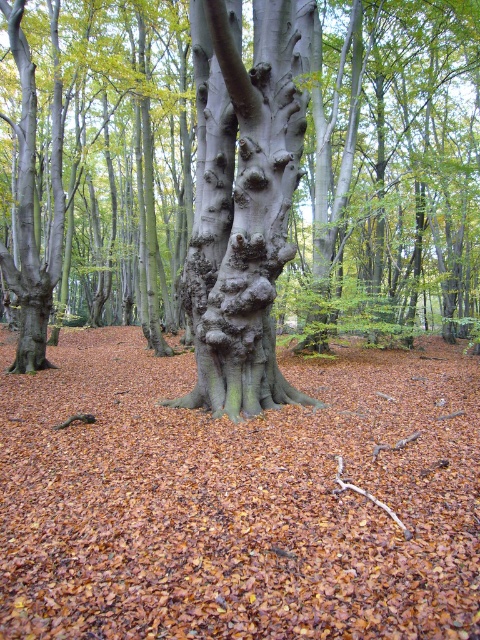
Does smooth gray tree trunk at center appear on the right side of smooth gray bark at center?

Incorrect, smooth gray tree trunk at center is not on the right side of smooth gray bark at center.

Is point (466, 125) positioned after point (196, 32)?

Yes, it is.

Locate an element on the screen. This screenshot has height=640, width=480. smooth gray tree trunk at center is located at coordinates (98, 163).

Is point (362, 392) closer to camera compared to point (241, 172)?

No, (362, 392) is further to viewer.

Is brown matte tree trunk at center closer to camera compared to smooth gray bark at center?

Yes, it is in front of smooth gray bark at center.

Does point (326, 472) lie behind point (261, 276)?

No, it is not.

Locate an element on the screen. This screenshot has width=480, height=640. brown matte tree trunk at center is located at coordinates (238, 499).

Who is positioned more to the left, brown matte tree trunk at center or smooth gray tree trunk at center?

smooth gray tree trunk at center

What do you see at coordinates (238, 499) in the screenshot?
I see `brown matte tree trunk at center` at bounding box center [238, 499].

I want to click on brown matte tree trunk at center, so click(238, 499).